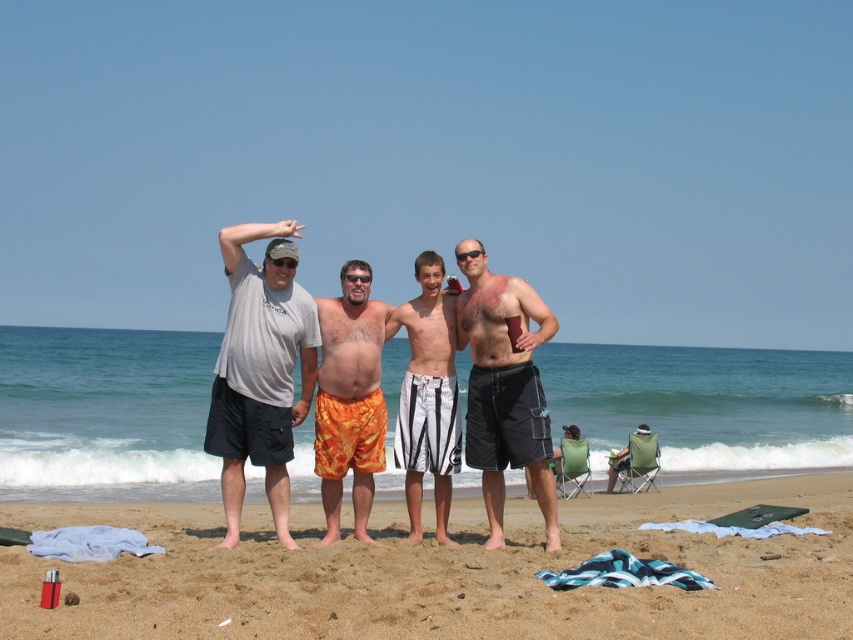
Looking at this image, you are a photographer trying to capture a group shot of the four people on the beach. You notice the orange printed shorts at center and the white striped shorts at center. Which pair of shorts is closer to the camera?

The orange printed shorts at center is positioned under white striped shorts at center, meaning it is closer to the camera since it appears below the other in the frame.

You are a photographer trying to capture a clear photo of the beige sand at center and the orange printed shorts at center. Which object will appear larger in the photo?

The orange printed shorts at center will appear larger in the photo since they are taller than the beige sand at center.